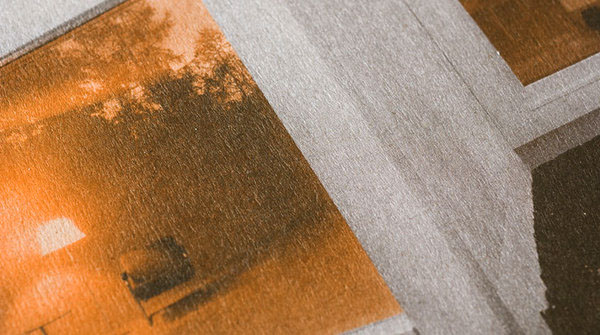
This screenshot has width=600, height=335. Find the location of `lamp`. lamp is located at coordinates (54, 232).